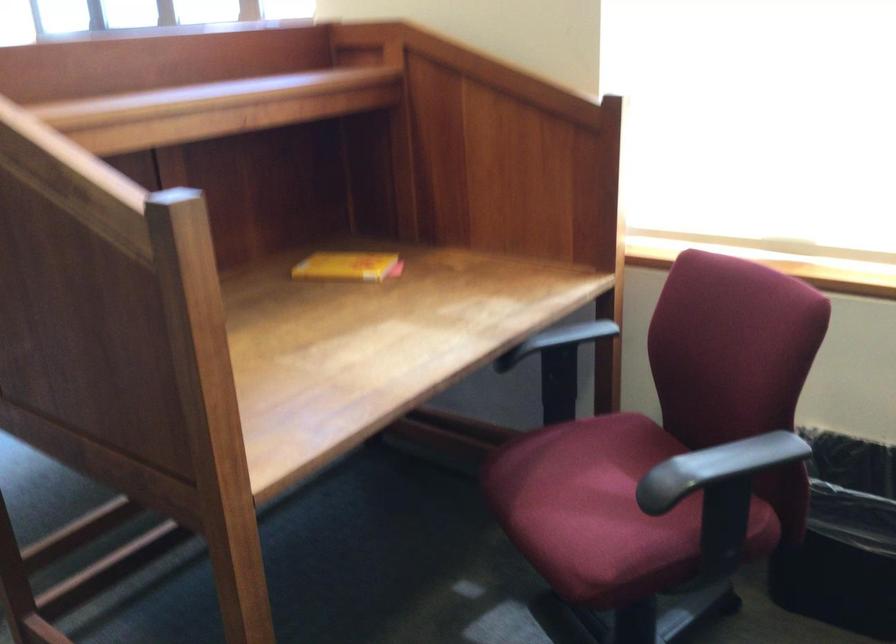
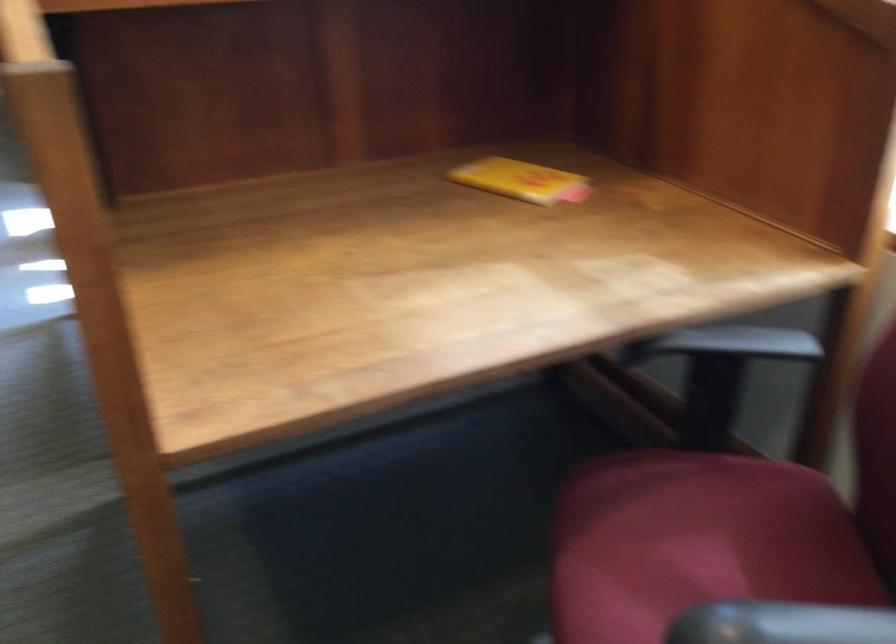
Based on the photo, the images are taken continuously from a first-person perspective. In which direction are you moving?

The cameraman walked toward right, forward.